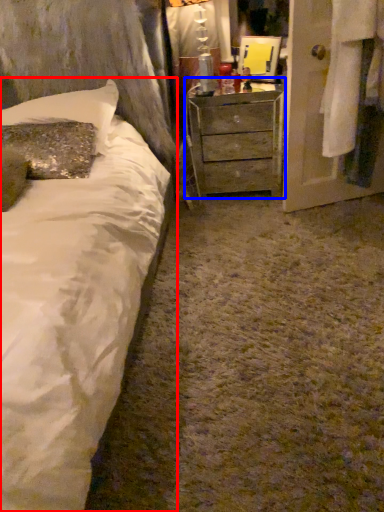
Question: Which of the following is the farthest to the observer, bed (highlighted by a red box) or chest of drawers (highlighted by a blue box)?

Choices:
 (A) bed
 (B) chest of drawers

Answer: (B)